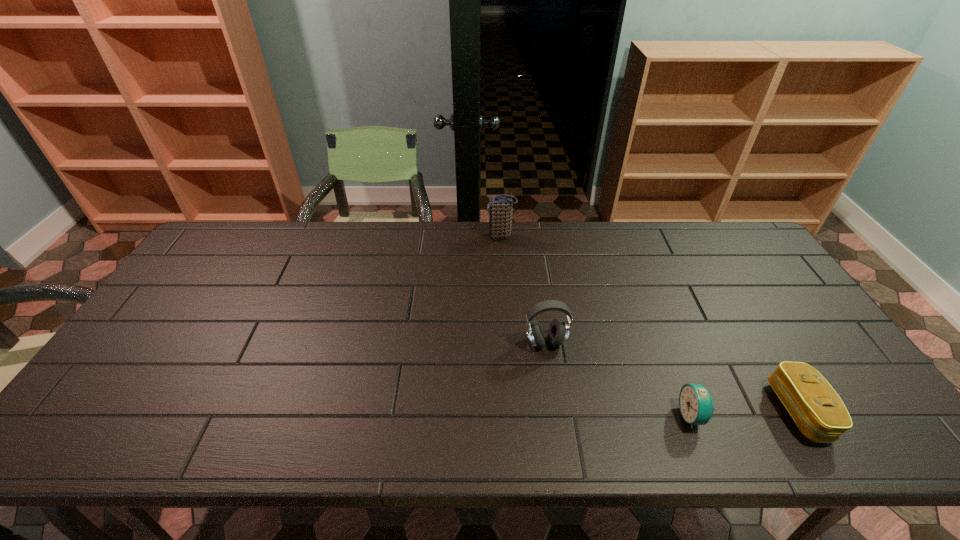
At what (x,y) coordinates should I click in order to perform the action: click on free region located 0.380m on the front-facing side of the alarm clock. Please return your answer as a coordinate pair (x, y). This screenshot has height=540, width=960. Looking at the image, I should click on (516, 415).

Image resolution: width=960 pixels, height=540 pixels. I want to click on vacant space located 0.210m on the front-facing side of the alarm clock, so click(589, 415).

Locate an element on the screen. The height and width of the screenshot is (540, 960). vacant space situated on the front-facing side of the alarm clock is located at coordinates (555, 415).

You are a GUI agent. You are given a task and a screenshot of the screen. Output one action in this format:
    pyautogui.click(x=<x>, y=<y>)
    Task: Click on the vacant position located 0.200m on the zipper side of the nearer clutch bag
    This screenshot has height=540, width=960.
    Given the screenshot: What is the action you would take?
    pyautogui.click(x=691, y=411)

Where is `vacant position located on the zipper side of the nearer clutch bag`? This screenshot has height=540, width=960. vacant position located on the zipper side of the nearer clutch bag is located at coordinates (713, 411).

This screenshot has width=960, height=540. In order to click on vacant space located 0.210m on the zipper side of the nearer clutch bag in this screenshot , I will do `click(687, 411)`.

At what (x,y) coordinates should I click in order to perform the action: click on object that is at the far edge. Please return your answer as a coordinate pair (x, y). The height and width of the screenshot is (540, 960). Looking at the image, I should click on (500, 207).

I want to click on alarm clock that is at the near edge, so click(696, 405).

The height and width of the screenshot is (540, 960). Find the location of `clutch bag that is at the near edge`. clutch bag that is at the near edge is located at coordinates (818, 411).

The height and width of the screenshot is (540, 960). Find the location of `object located at the right edge`. object located at the right edge is located at coordinates (818, 411).